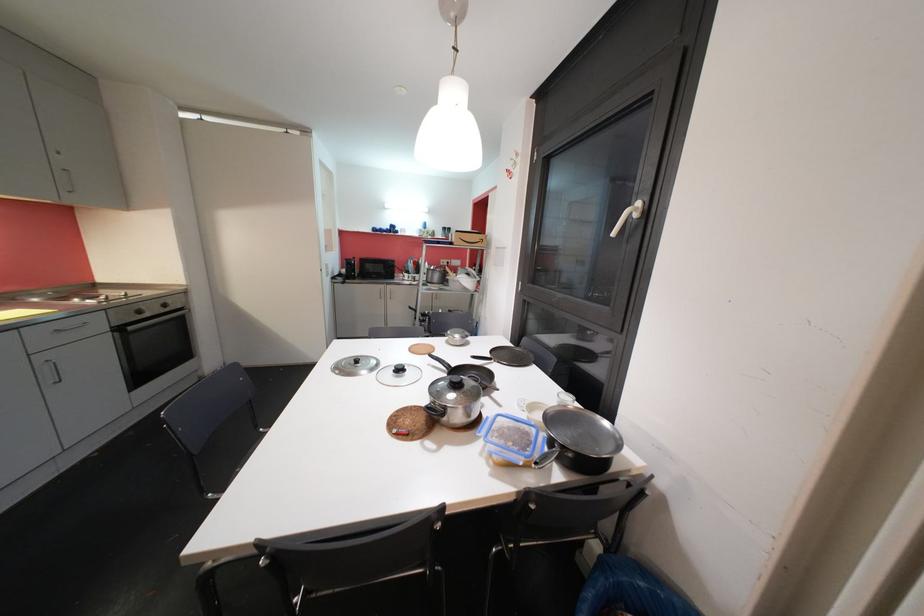
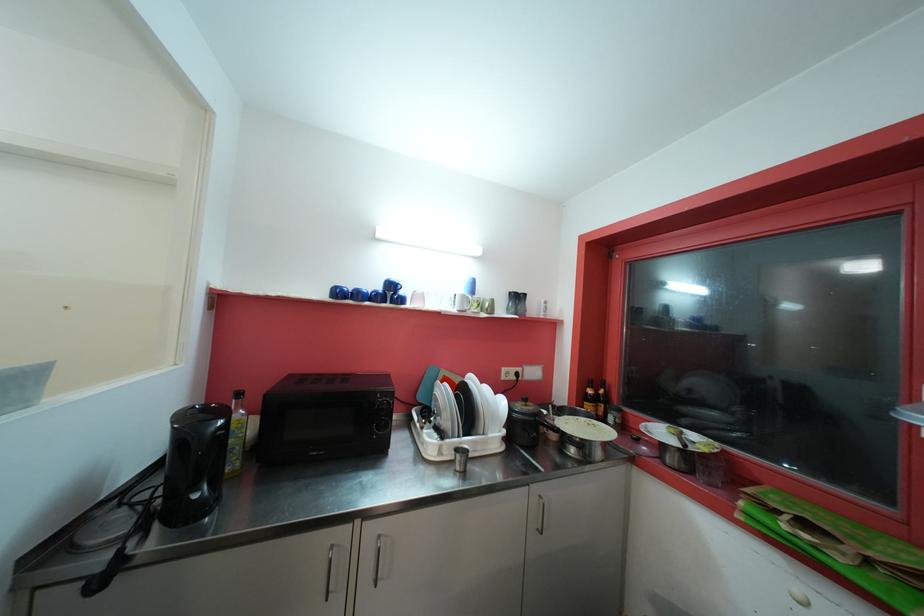
The point at (383,230) is marked in the first image. Where is the corresponding point in the second image?

(354, 290)